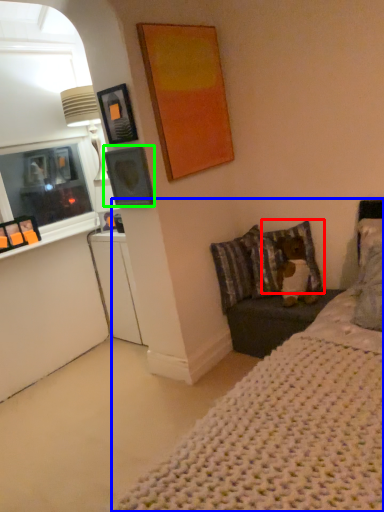
Question: Estimate the real-world distances between objects in this image. Which object is closer to pillow (highlighted by a red box), bed (highlighted by a blue box) or picture frame (highlighted by a green box)?

Choices:
 (A) bed
 (B) picture frame

Answer: (B)